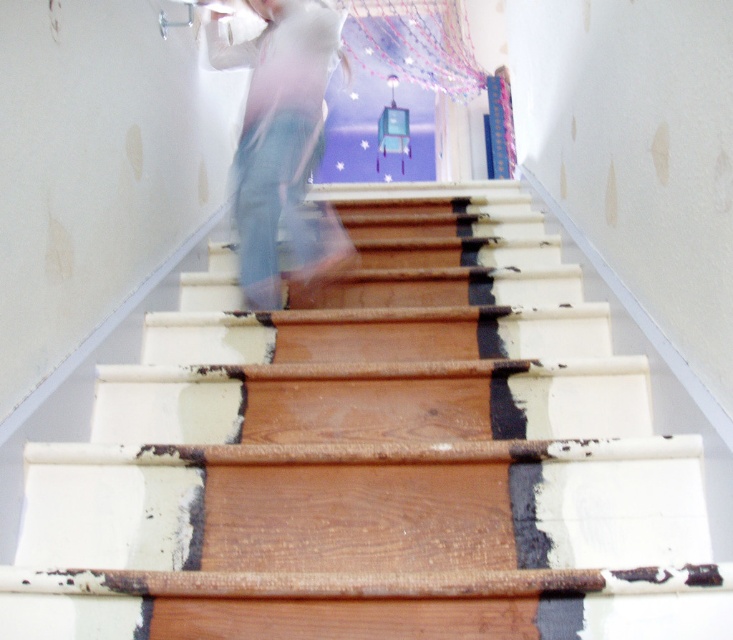
Question: Which point is farther from the camera taking this photo?

Choices:
 (A) (169, 340)
 (B) (279, 200)

Answer: (B)

Question: Can you confirm if wooden stairs at center is positioned above light blue jeans at center?

Choices:
 (A) no
 (B) yes

Answer: (A)

Question: Does wooden stairs at center have a greater width compared to light blue jeans at center?

Choices:
 (A) no
 (B) yes

Answer: (B)

Question: Is wooden stairs at center thinner than light blue jeans at center?

Choices:
 (A) no
 (B) yes

Answer: (A)

Question: Which point is closer to the camera?

Choices:
 (A) wooden stairs at center
 (B) light blue jeans at center

Answer: (A)